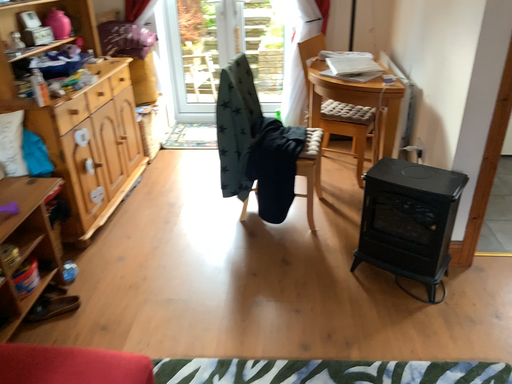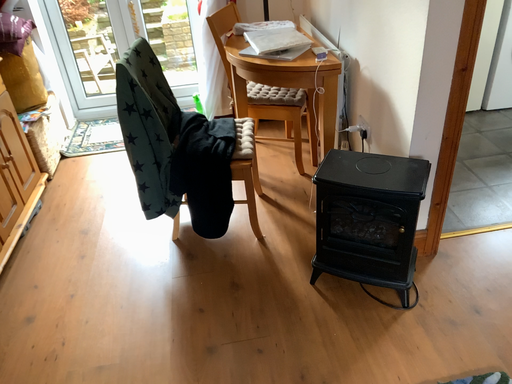
Question: How did the camera likely rotate when shooting the video?

Choices:
 (A) rotated left
 (B) rotated right

Answer: (B)